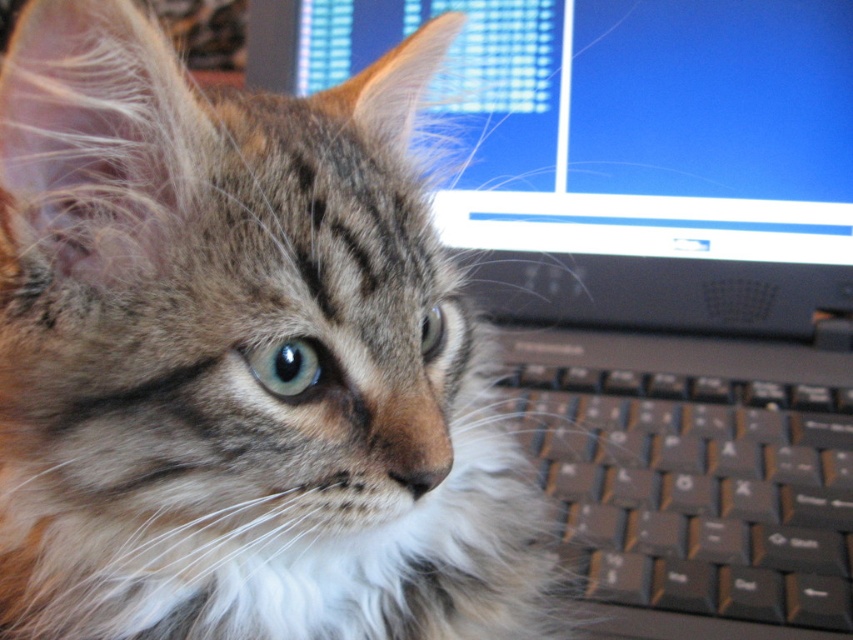
Question: Which point is closer to the camera?

Choices:
 (A) (784, 605)
 (B) (242, 563)

Answer: (B)

Question: Is matte plastic monitor at upper center closer to camera compared to black plastic keyboard at lower right?

Choices:
 (A) no
 (B) yes

Answer: (A)

Question: Based on their relative distances, which object is nearer to the fuzzy tabby cat at center?

Choices:
 (A) black plastic keyboard at lower right
 (B) matte plastic monitor at upper center

Answer: (A)

Question: Can you confirm if fuzzy tabby cat at center is positioned to the left of black plastic keyboard at lower right?

Choices:
 (A) no
 (B) yes

Answer: (B)

Question: Does fuzzy tabby cat at center appear over black plastic keyboard at lower right?

Choices:
 (A) no
 (B) yes

Answer: (B)

Question: Among these points, which one is farthest from the camera?

Choices:
 (A) (171, 230)
 (B) (749, 307)

Answer: (B)